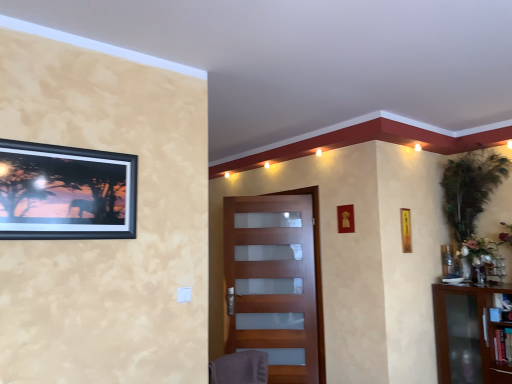
Question: From the image's perspective, is yellow paper at upper right, the 2th picture frame positioned from the left, on transparent glass cabinet at right?

Choices:
 (A) yes
 (B) no

Answer: (A)

Question: From a real-world perspective, is yellow paper at upper right, the first picture frame viewed from the right, physically below transparent glass cabinet at right?

Choices:
 (A) no
 (B) yes

Answer: (A)

Question: Is yellow paper at upper right, the first picture frame in the bottom-to-top sequence, in contact with transparent glass cabinet at right?

Choices:
 (A) no
 (B) yes

Answer: (A)

Question: Is yellow paper at upper right, placed as the second picture frame when sorted from front to back, shorter than transparent glass cabinet at right?

Choices:
 (A) no
 (B) yes

Answer: (B)

Question: From the image's perspective, would you say yellow paper at upper right, the 2th picture frame positioned from the left, is shown under transparent glass cabinet at right?

Choices:
 (A) yes
 (B) no

Answer: (B)

Question: From the image's perspective, is transparent glass cabinet at right located above or below black matte picture frame at upper left, which is counted as the second picture frame, starting from the right?

Choices:
 (A) below
 (B) above

Answer: (A)

Question: Do you think transparent glass cabinet at right is within black matte picture frame at upper left, acting as the 2th picture frame starting from the back, or outside of it?

Choices:
 (A) inside
 (B) outside

Answer: (B)

Question: Visually, is transparent glass cabinet at right positioned to the left or to the right of black matte picture frame at upper left, arranged as the first picture frame when viewed from the left?

Choices:
 (A) left
 (B) right

Answer: (B)

Question: Is transparent glass cabinet at right in front of or behind black matte picture frame at upper left, which is counted as the second picture frame, starting from the right, in the image?

Choices:
 (A) behind
 (B) front

Answer: (A)

Question: Is black matte picture frame at upper left, arranged as the first picture frame when viewed from the left, situated inside gray fabric swivel chair at lower center or outside?

Choices:
 (A) outside
 (B) inside

Answer: (A)

Question: In terms of height, does black matte picture frame at upper left, placed as the 1th picture frame when sorted from top to bottom, look taller or shorter compared to gray fabric swivel chair at lower center?

Choices:
 (A) short
 (B) tall

Answer: (B)

Question: Is point (35, 215) closer or farther from the camera than point (247, 370)?

Choices:
 (A) farther
 (B) closer

Answer: (B)

Question: From the image's perspective, relative to gray fabric swivel chair at lower center, is black matte picture frame at upper left, which is counted as the second picture frame, starting from the right, above or below?

Choices:
 (A) below
 (B) above

Answer: (B)

Question: In terms of width, does matte wood door at center look wider or thinner when compared to transparent glass cabinet at right?

Choices:
 (A) wide
 (B) thin

Answer: (B)

Question: From the image's perspective, is matte wood door at center positioned above or below transparent glass cabinet at right?

Choices:
 (A) above
 (B) below

Answer: (A)